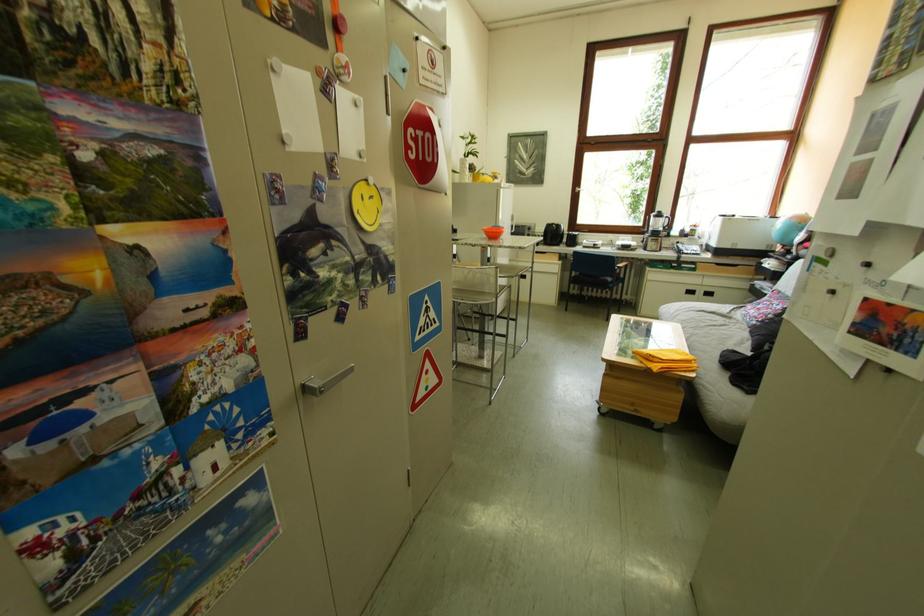
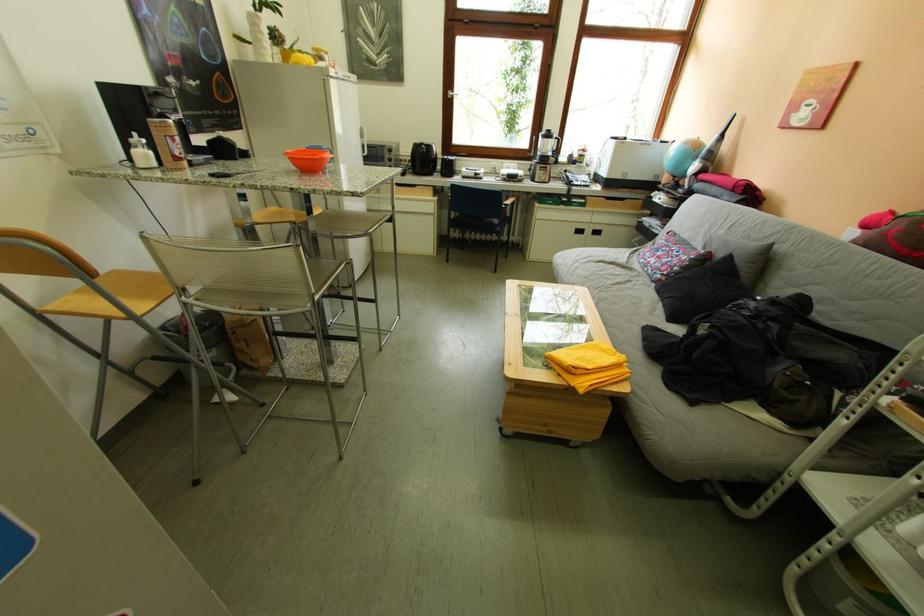
Locate, in the second image, the point that corresponds to point (654, 233) in the first image.

(541, 156)